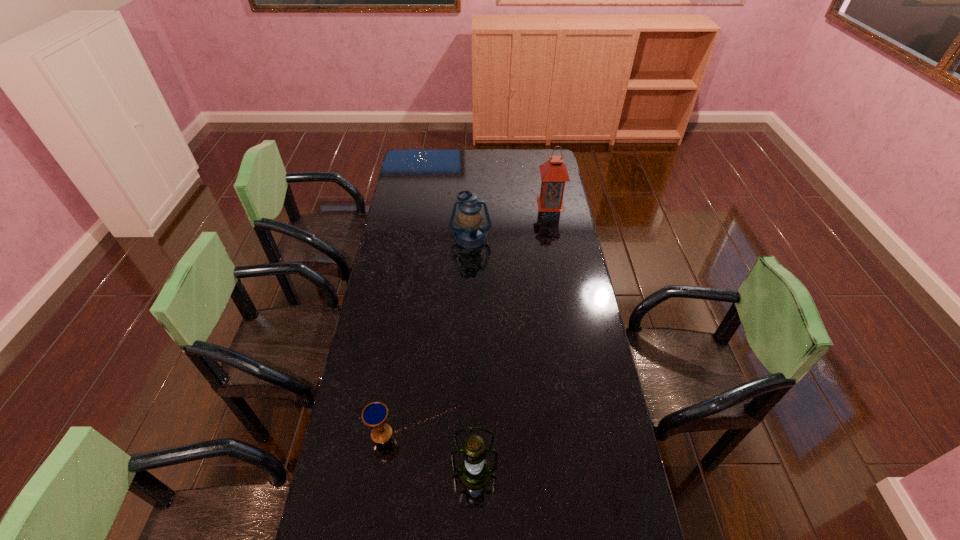
Where is `object located in the left edge section of the desktop`? object located in the left edge section of the desktop is located at coordinates (375, 415).

Identify the location of object that is at the right edge. Image resolution: width=960 pixels, height=540 pixels. (554, 174).

Image resolution: width=960 pixels, height=540 pixels. I want to click on free space at the far edge, so click(461, 159).

Where is `vacant space at the left edge of the desktop`? vacant space at the left edge of the desktop is located at coordinates (420, 237).

Where is `vacant region at the right edge`? This screenshot has height=540, width=960. vacant region at the right edge is located at coordinates (550, 241).

Where is `empty space between the third tallest object and the nearest lantern`? empty space between the third tallest object and the nearest lantern is located at coordinates (472, 355).

Where is `free spot between the second farthest lantern and the chalice`? The height and width of the screenshot is (540, 960). free spot between the second farthest lantern and the chalice is located at coordinates (426, 335).

Locate an element on the screen. vacant region between the farthest lantern and the second nearest object is located at coordinates tap(466, 319).

Where is `vacant area between the second farthest lantern and the third farthest object`? This screenshot has width=960, height=540. vacant area between the second farthest lantern and the third farthest object is located at coordinates (426, 335).

This screenshot has height=540, width=960. What are the coordinates of `unoccupied position between the nearest object and the rightmost lantern` in the screenshot? It's located at (513, 339).